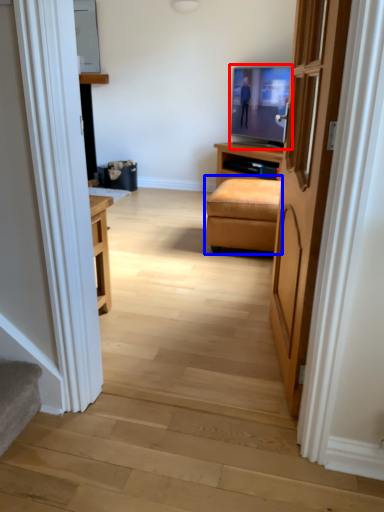
Question: Which of the following is the farthest to the observer, television (highlighted by a red box) or studio couch (highlighted by a blue box)?

Choices:
 (A) television
 (B) studio couch

Answer: (A)